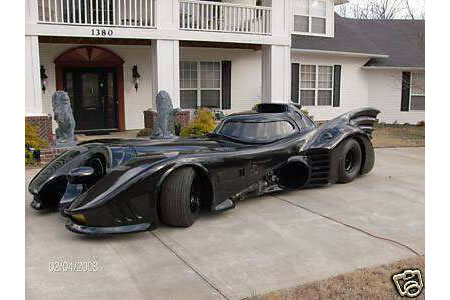
Find the location of a particular element. light sconces is located at coordinates [x=135, y=78], [x=43, y=82].